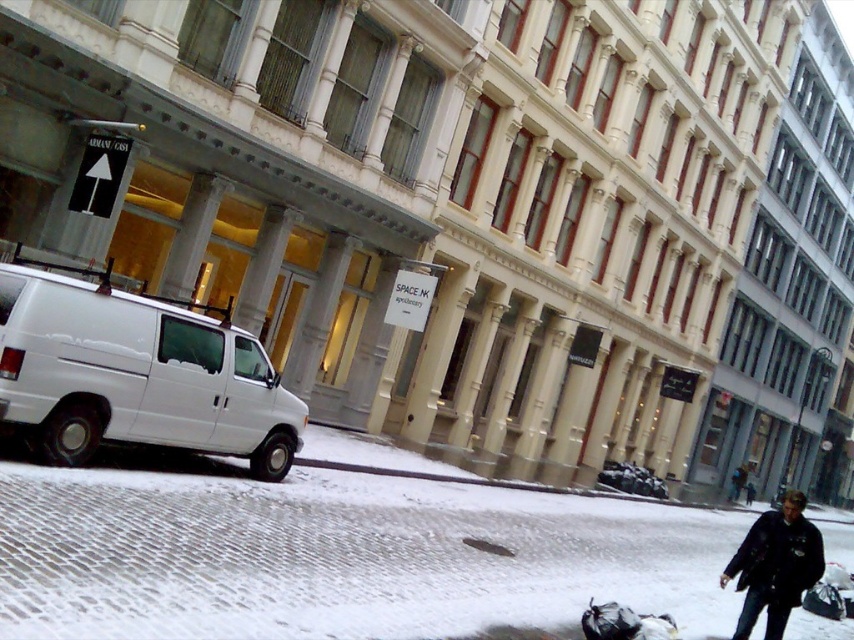
Question: Is white matte van at left bigger than black leather jacket at lower right?

Choices:
 (A) no
 (B) yes

Answer: (A)

Question: Which of the following is the closest to the observer?

Choices:
 (A) black leather jacket at lower right
 (B) snowy cobblestone pavement at lower left
 (C) white matte van at left

Answer: (B)

Question: Which of the following is the farthest from the observer?

Choices:
 (A) black leather jacket at lower right
 (B) white matte van at left

Answer: (B)

Question: Which object is the farthest from the black leather jacket at lower right?

Choices:
 (A) white matte van at left
 (B) snowy cobblestone pavement at lower left

Answer: (A)

Question: Does snowy cobblestone pavement at lower left come in front of white matte van at left?

Choices:
 (A) yes
 (B) no

Answer: (A)

Question: Can you confirm if snowy cobblestone pavement at lower left is wider than white matte van at left?

Choices:
 (A) yes
 (B) no

Answer: (A)